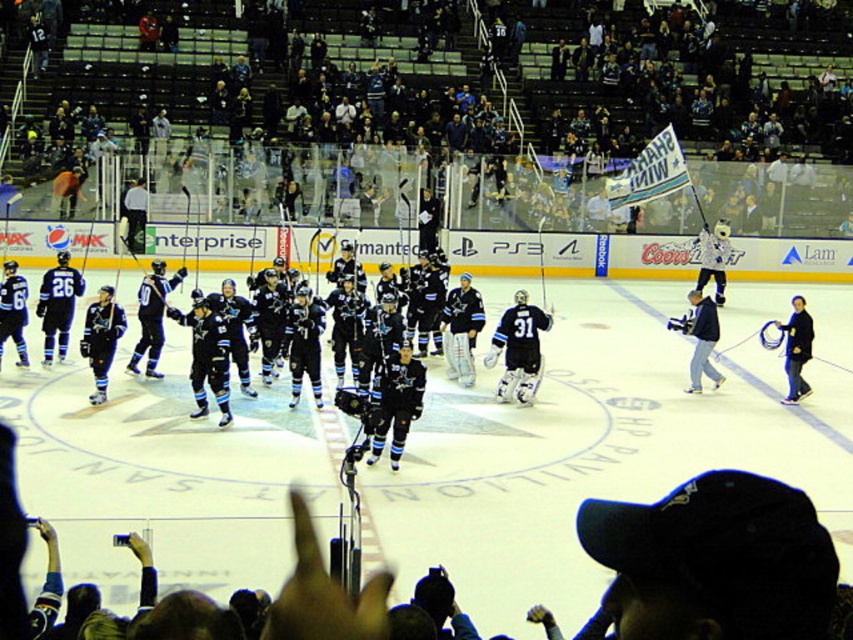
Is dark blue jersey at upper center positioned at the back of black jersey at center?

Yes, it is.

Which is in front, point (170, 161) or point (293, 259)?

Positioned in front is point (170, 161).

Who is more forward, [207,49] or [74,225]?

Positioned in front is point [74,225].

At what (x,y) coordinates should I click in order to perform the action: click on dark blue jersey at upper center. Please return your answer as a coordinate pair (x, y). Looking at the image, I should click on (445, 115).